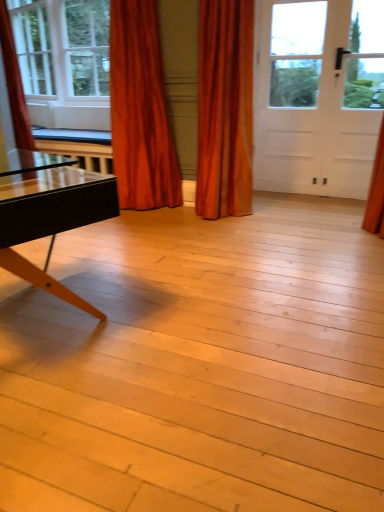
Question: Is white matte door at upper right outside of velvet orange curtain at left, which appears as the third curtain when viewed from the right?

Choices:
 (A) no
 (B) yes

Answer: (B)

Question: From the image's perspective, is white matte door at upper right on velvet orange curtain at left, which appears as the third curtain when viewed from the right?

Choices:
 (A) no
 (B) yes

Answer: (A)

Question: Is white matte door at upper right looking in the opposite direction of velvet orange curtain at left, which appears as the first curtain when viewed from the left?

Choices:
 (A) yes
 (B) no

Answer: (B)

Question: Are white matte door at upper right and velvet orange curtain at left, which appears as the third curtain when viewed from the right, located far from each other?

Choices:
 (A) yes
 (B) no

Answer: (A)

Question: Would you say white matte door at upper right contains velvet orange curtain at left, which appears as the third curtain when viewed from the right?

Choices:
 (A) no
 (B) yes

Answer: (A)

Question: From a real-world perspective, is satin orange curtain at upper left, arranged as the 2th curtain when viewed from the left, positioned above or below white matte door at upper right?

Choices:
 (A) above
 (B) below

Answer: (B)

Question: Choose the correct answer: Is satin orange curtain at upper left, arranged as the 2th curtain when viewed from the left, inside white matte door at upper right or outside it?

Choices:
 (A) inside
 (B) outside

Answer: (B)

Question: Is point (112, 114) closer or farther from the camera than point (307, 185)?

Choices:
 (A) farther
 (B) closer

Answer: (B)

Question: Is satin orange curtain at upper left, arranged as the 2th curtain when viewed from the left, wider or thinner than white matte door at upper right?

Choices:
 (A) thin
 (B) wide

Answer: (B)

Question: From the image's perspective, is velvet orange curtain at left, which appears as the first curtain when viewed from the left, above or below white matte door at upper right?

Choices:
 (A) above
 (B) below

Answer: (A)

Question: Considering the relative positions of velvet orange curtain at left, which appears as the first curtain when viewed from the left, and white matte door at upper right in the image provided, is velvet orange curtain at left, which appears as the first curtain when viewed from the left, to the left or to the right of white matte door at upper right?

Choices:
 (A) right
 (B) left

Answer: (B)

Question: Considering the positions of velvet orange curtain at left, which appears as the first curtain when viewed from the left, and white matte door at upper right in the image, is velvet orange curtain at left, which appears as the first curtain when viewed from the left, bigger or smaller than white matte door at upper right?

Choices:
 (A) big
 (B) small

Answer: (A)

Question: In the image, is velvet orange curtain at left, which appears as the first curtain when viewed from the left, positioned in front of or behind white matte door at upper right?

Choices:
 (A) front
 (B) behind

Answer: (A)

Question: Visually, is white matte door at upper right positioned to the left or to the right of velvet orange curtain at left, which appears as the first curtain when viewed from the left?

Choices:
 (A) left
 (B) right

Answer: (B)

Question: Is white matte door at upper right inside or outside of velvet orange curtain at left, which appears as the third curtain when viewed from the right?

Choices:
 (A) inside
 (B) outside

Answer: (B)